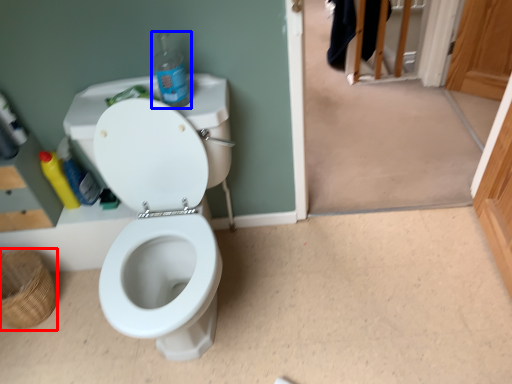
Question: Which object is further to the camera taking this photo, basket (highlighted by a red box) or bottle (highlighted by a blue box)?

Choices:
 (A) basket
 (B) bottle

Answer: (A)